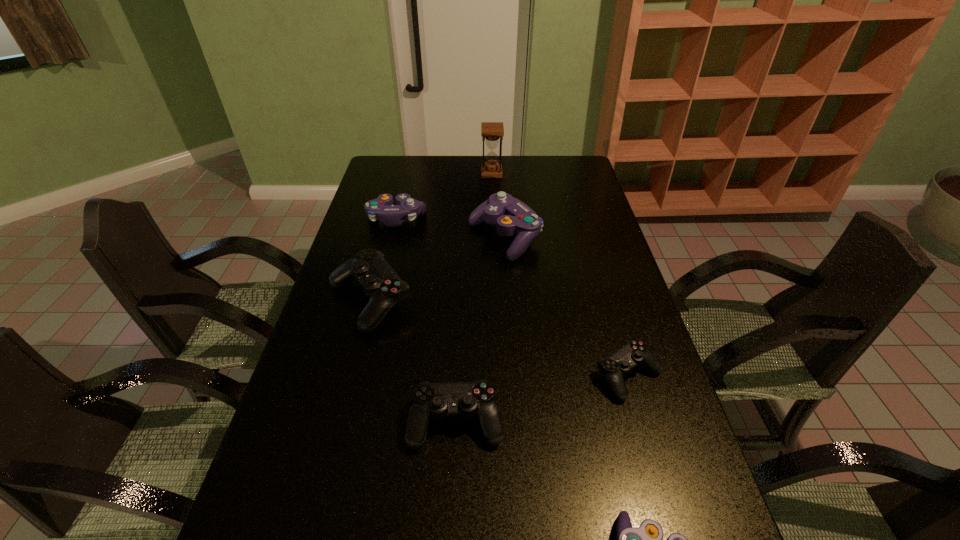
The image size is (960, 540). In order to click on free space located on the back of the leftmost black control in this screenshot , I will do `click(381, 256)`.

Identify the location of vacant space situated 0.290m on the right of the leftmost purple control. The width and height of the screenshot is (960, 540). (505, 220).

Locate an element on the screen. This screenshot has height=540, width=960. vacant region located 0.370m on the back of the second smallest black control is located at coordinates (462, 289).

Where is `free space located on the back of the smallest black control`? Image resolution: width=960 pixels, height=540 pixels. free space located on the back of the smallest black control is located at coordinates (609, 309).

What are the coordinates of `object at the far edge` in the screenshot? It's located at (491, 131).

The width and height of the screenshot is (960, 540). I want to click on object located at the right edge, so click(633, 353).

Where is `blank space at the far edge of the desktop`? This screenshot has height=540, width=960. blank space at the far edge of the desktop is located at coordinates (503, 175).

The image size is (960, 540). What are the coordinates of `blank space at the left edge of the desktop` in the screenshot? It's located at (403, 187).

Where is `vacant space at the right edge of the desktop`? This screenshot has height=540, width=960. vacant space at the right edge of the desktop is located at coordinates (633, 487).

Locate an element on the screen. The height and width of the screenshot is (540, 960). free spot between the second black control from right to left and the smallest black control is located at coordinates pyautogui.click(x=542, y=399).